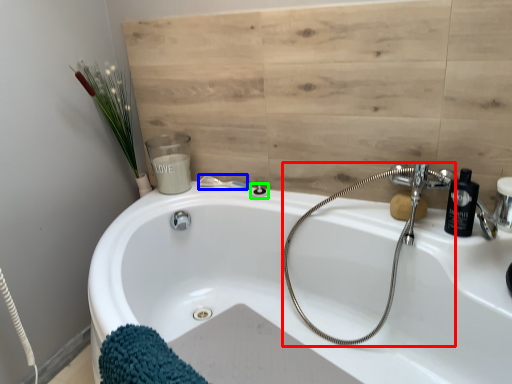
Question: Which object is the farthest from plumbing fixture (highlighted by a red box)? Choose among these: shower (highlighted by a blue box) or shower (highlighted by a green box).

Choices:
 (A) shower
 (B) shower

Answer: (A)